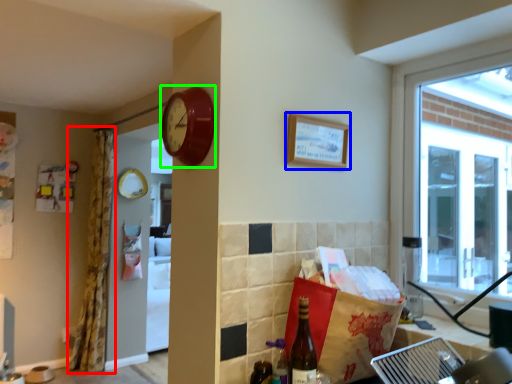
Question: Which object is the closest to the curtain (highlighted by a red box)? Choose among these: picture frame (highlighted by a blue box) or clock (highlighted by a green box).

Choices:
 (A) picture frame
 (B) clock

Answer: (B)